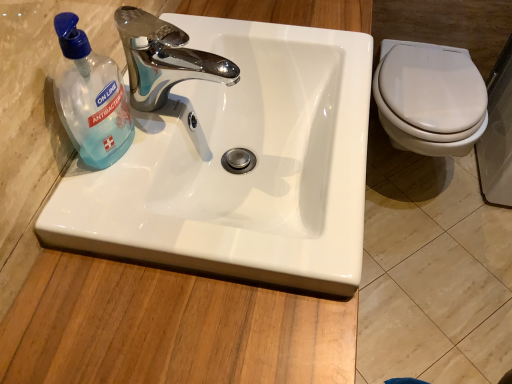
Question: From a real-world perspective, is chrome/metallic faucet at upper center located beneath white glossy sink at center?

Choices:
 (A) yes
 (B) no

Answer: (B)

Question: Can you confirm if chrome/metallic faucet at upper center is positioned to the right of white glossy sink at center?

Choices:
 (A) no
 (B) yes

Answer: (A)

Question: From the image's perspective, is chrome/metallic faucet at upper center beneath white glossy sink at center?

Choices:
 (A) no
 (B) yes

Answer: (A)

Question: Is the depth of chrome/metallic faucet at upper center less than that of white glossy sink at center?

Choices:
 (A) yes
 (B) no

Answer: (B)

Question: Is chrome/metallic faucet at upper center located outside white glossy sink at center?

Choices:
 (A) no
 (B) yes

Answer: (B)

Question: Is white glossy sink at center at the back of chrome/metallic faucet at upper center?

Choices:
 (A) no
 (B) yes

Answer: (A)

Question: From the image's perspective, is white glossy sink at center above chrome/metallic faucet at upper center?

Choices:
 (A) no
 (B) yes

Answer: (A)

Question: Could you tell me if white glossy sink at center is turned towards chrome/metallic faucet at upper center?

Choices:
 (A) no
 (B) yes

Answer: (A)

Question: Is white glossy sink at center at the right side of chrome/metallic faucet at upper center?

Choices:
 (A) yes
 (B) no

Answer: (A)

Question: Does white glossy sink at center touch chrome/metallic faucet at upper center?

Choices:
 (A) no
 (B) yes

Answer: (A)

Question: Is white glossy sink at center at the left side of chrome/metallic faucet at upper center?

Choices:
 (A) no
 (B) yes

Answer: (A)

Question: From the image's perspective, is white glossy sink at center located beneath chrome/metallic faucet at upper center?

Choices:
 (A) no
 (B) yes

Answer: (B)

Question: Does white glossy sink at center have a lesser width compared to transparent plastic bottle at left?

Choices:
 (A) no
 (B) yes

Answer: (A)